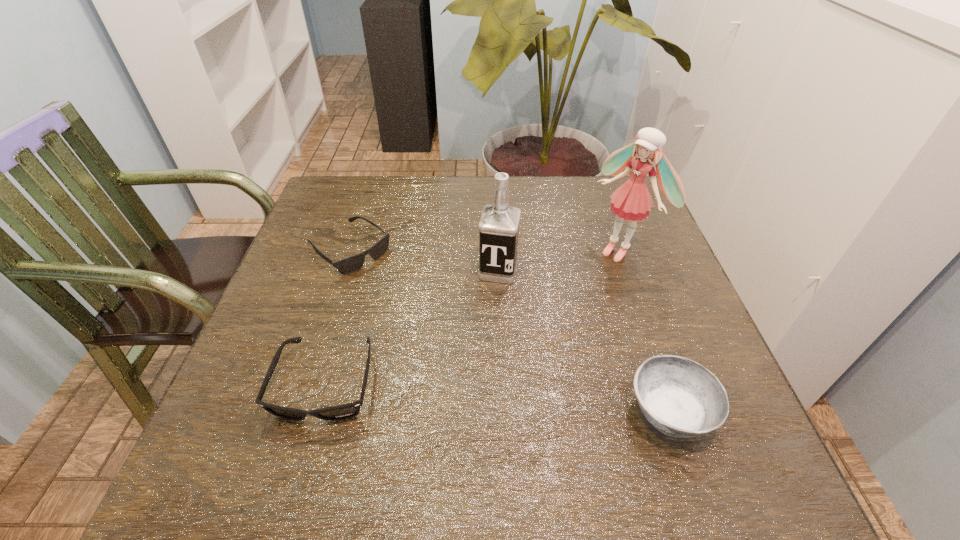
The image size is (960, 540). In order to click on the taller sunglasses in this screenshot , I will do `click(340, 412)`.

Where is `the second shortest object`? The image size is (960, 540). the second shortest object is located at coordinates (340, 412).

This screenshot has width=960, height=540. I want to click on ashtray, so click(681, 398).

Locate an element on the screen. doll is located at coordinates (632, 201).

In order to click on the fourth shortest object in this screenshot , I will do `click(498, 227)`.

You are a GUI agent. You are given a task and a screenshot of the screen. Output one action in this format:
    pyautogui.click(x=<x>, y=<y>)
    Task: Click on the third object from right to left
    
    Given the screenshot: What is the action you would take?
    pyautogui.click(x=498, y=227)

Find the location of a particular element. This screenshot has height=540, width=960. the shortest object is located at coordinates (352, 263).

The width and height of the screenshot is (960, 540). Identify the location of the shorter sunglasses. (352, 263).

This screenshot has height=540, width=960. I want to click on free space located 0.180m on the back of the ashtray, so click(634, 305).

Find the location of a particular element. Image resolution: width=960 pixels, height=540 pixels. vacant area situated 0.230m on the front-facing side of the doll is located at coordinates [x=540, y=316].